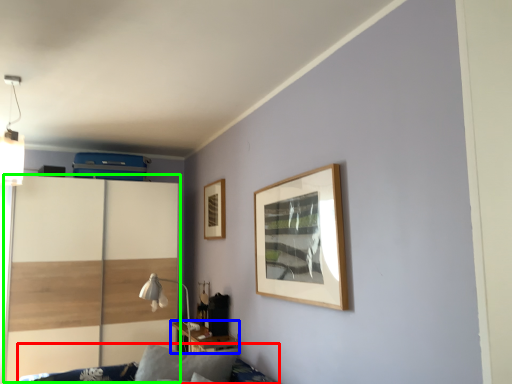
Question: Which is farther away from furniture (highlighted by a red box)? table (highlighted by a blue box) or dresser (highlighted by a green box)?

Choices:
 (A) table
 (B) dresser

Answer: (B)